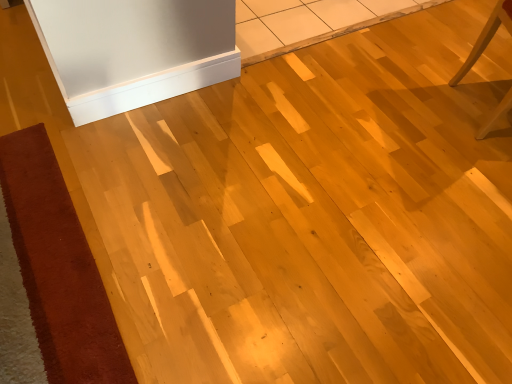
Find the location of a particular element. Image resolution: width=512 pixels, height=384 pixels. free space underneath white glossy baseboard at upper center (from a real-world perspective) is located at coordinates (161, 92).